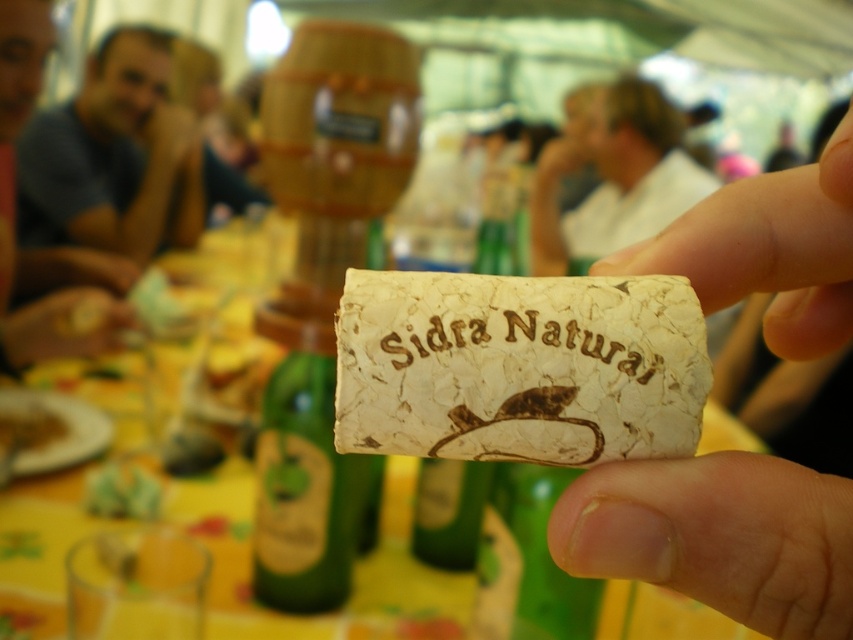
Between green leafy vegetable at lower left and yellow matte plate at lower left, which one is positioned higher?

yellow matte plate at lower left is above.

Does point (114, 496) come closer to viewer compared to point (21, 444)?

That is True.

The image size is (853, 640). Find the location of `green leafy vegetable at lower left`. green leafy vegetable at lower left is located at coordinates (122, 492).

Is blue cotton shirt at upper left positioned at the back of matte blue shirt at upper left?

Yes, blue cotton shirt at upper left is behind matte blue shirt at upper left.

Identify the location of blue cotton shirt at upper left. (114, 156).

Locate an element on the screen. This screenshot has width=853, height=640. natural cork at upper center is located at coordinates (718, 536).

Consider the image. Is natural cork at upper center to the left of smooth yellow lemon at lower left from the viewer's perspective?

No, natural cork at upper center is not to the left of smooth yellow lemon at lower left.

Does point (595, 572) come behind point (33, 317)?

No, it is not.

Locate an element on the screen. natural cork at upper center is located at coordinates (718, 536).